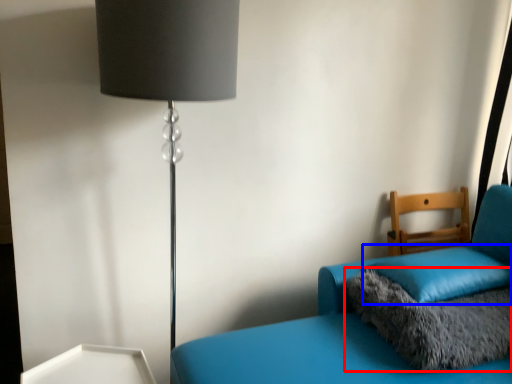
Question: Which object appears farthest to the camera in this image, pillow (highlighted by a red box) or pillow (highlighted by a blue box)?

Choices:
 (A) pillow
 (B) pillow

Answer: (B)